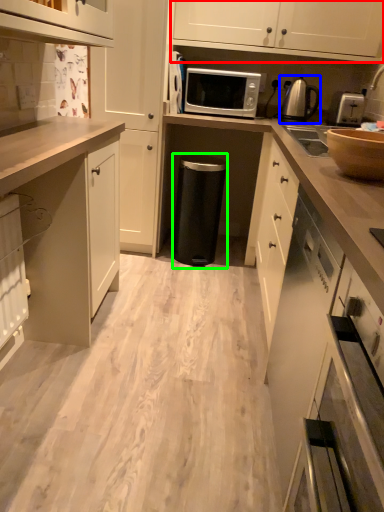
Question: Which object is positioned farthest from cabinetry (highlighted by a red box)? Select from kitchen appliance (highlighted by a blue box) and appliance (highlighted by a green box).

Choices:
 (A) kitchen appliance
 (B) appliance

Answer: (B)